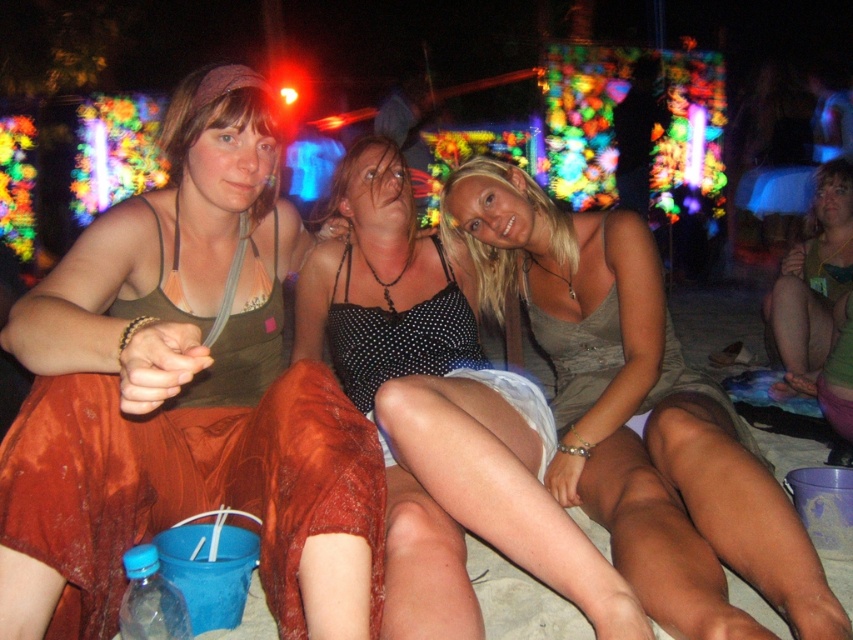
Question: Can you confirm if matte green tank top at center is smaller than matte gray dress at center?

Choices:
 (A) no
 (B) yes

Answer: (B)

Question: Can you confirm if matte green tank top at center is bigger than polka dot tank top at center?

Choices:
 (A) no
 (B) yes

Answer: (A)

Question: Among these objects, which one is farthest from the camera?

Choices:
 (A) green fabric dress at lower right
 (B) matte green tank top at center
 (C) matte gray dress at center

Answer: (A)

Question: Observing the image, what is the correct spatial positioning of matte green tank top at center in reference to green fabric dress at lower right?

Choices:
 (A) above
 (B) below

Answer: (B)

Question: Which object appears farthest from the camera in this image?

Choices:
 (A) matte green tank top at center
 (B) matte gray dress at center

Answer: (B)

Question: Which of these objects is positioned closest to the matte gray dress at center?

Choices:
 (A) green fabric dress at lower right
 (B) polka dot tank top at center

Answer: (B)